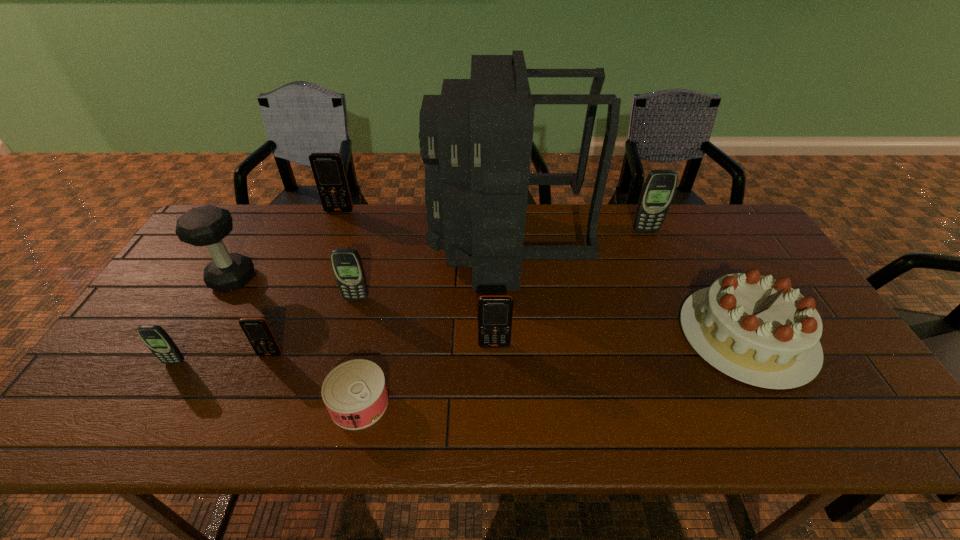
Identify the location of vacant area situated on the screen of the farthest cellular telephone. This screenshot has height=540, width=960. (307, 294).

At what (x,y) coordinates should I click in order to perform the action: click on free space located 0.290m on the screen of the rightmost cellular telephone. Please return your answer as a coordinate pair (x, y). Looking at the image, I should click on (674, 297).

Find the location of a particular element. This screenshot has width=960, height=540. free region located 0.070m on the left of the dumbbell is located at coordinates (186, 279).

Find the location of a particular element. The width and height of the screenshot is (960, 540). vacant space situated 0.330m on the screen of the second gray cellular telephone from right to left is located at coordinates (326, 408).

Image resolution: width=960 pixels, height=540 pixels. In order to click on vacant space positioned on the screen of the second nearest orange cellular telephone in this screenshot , I will do `click(496, 406)`.

This screenshot has height=540, width=960. Find the location of `free space located on the back of the birthday cake`. free space located on the back of the birthday cake is located at coordinates (689, 231).

Image resolution: width=960 pixels, height=540 pixels. I want to click on free space located 0.160m on the screen of the nearest orange cellular telephone, so click(245, 416).

Identify the location of vacant space located on the screen of the smallest gray cellular telephone. (134, 430).

Locate an element on the screen. The width and height of the screenshot is (960, 540). free space located 0.060m on the left of the can is located at coordinates (303, 403).

Identify the location of backpack at the far edge. This screenshot has height=540, width=960. (476, 137).